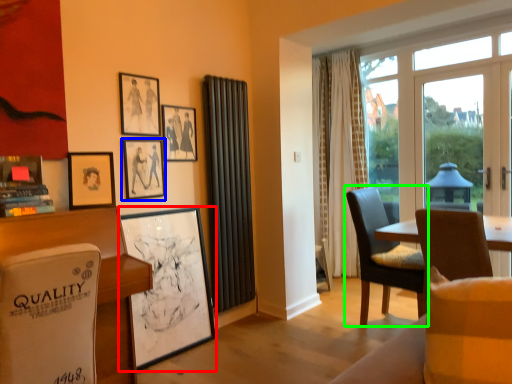
Question: Which object is the closest to the picture frame (highlighted by a red box)? Choose among these: picture frame (highlighted by a blue box) or chair (highlighted by a green box).

Choices:
 (A) picture frame
 (B) chair

Answer: (A)